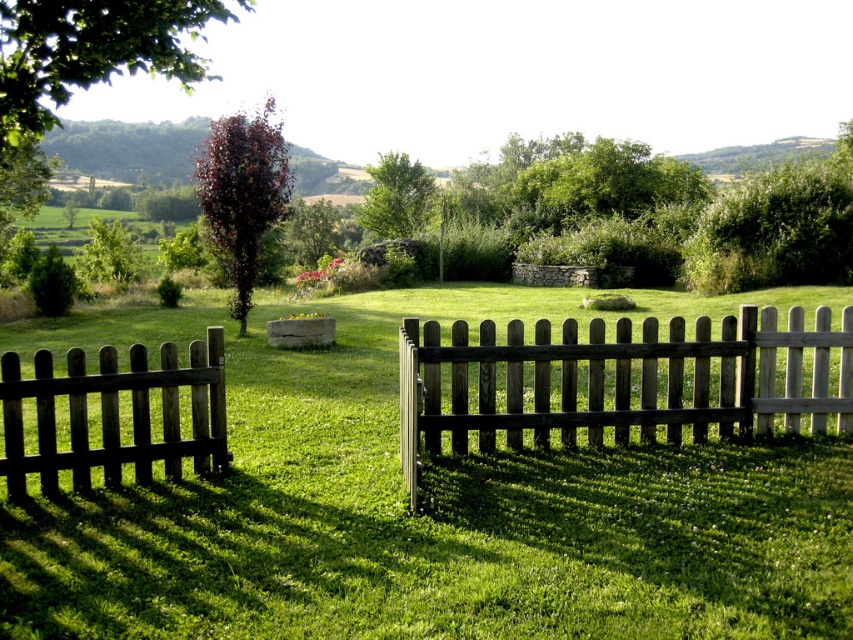
You are standing in the garden and want to take a photo of the green leafy tree at upper left without the brown wooden fence at left blocking the view. Is this possible?

The green leafy tree at upper left is behind the brown wooden fence at left, so it is already blocked by the fence. Therefore, you cannot take a photo of the green leafy tree at upper left without the brown wooden fence at left blocking the view.

You are standing in the garden and want to take a photo of the wooden picket fence at center and the green leafy tree at upper left. Which object will appear larger in the photo if you focus on the fence?

The wooden picket fence at center will appear larger in the photo because it is closer to the camera than the green leafy tree at upper left, which is further away.

You are standing in the garden and want to water both the green leafy tree at upper left and the green leafy tree at center. Which tree should you water first if you want to start with the one closer to you?

You should water the green leafy tree at upper left first because it is closer to the viewer than the green leafy tree at center.